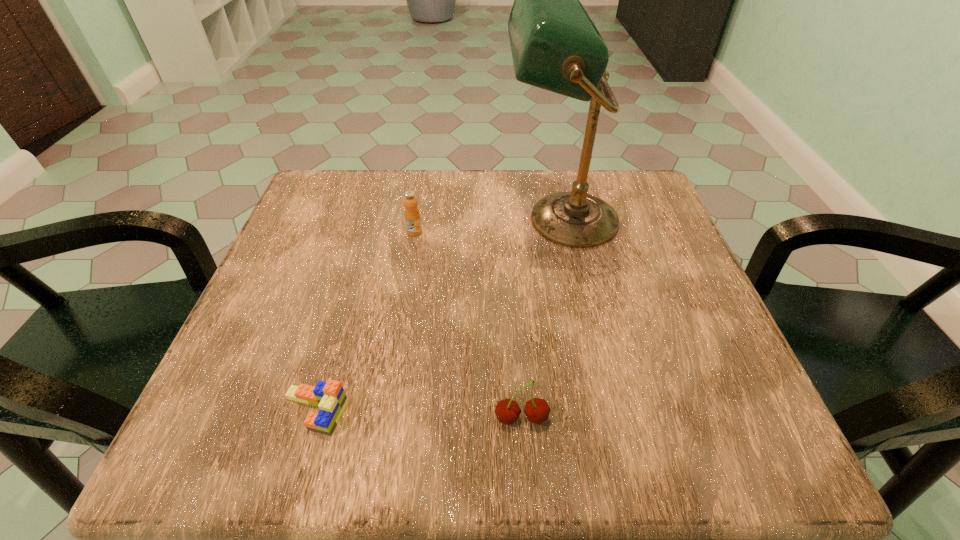
The image size is (960, 540). I want to click on the tallest object, so click(555, 46).

Image resolution: width=960 pixels, height=540 pixels. Identify the location of orange juice. (412, 215).

Find the location of a particular element. This screenshot has width=960, height=540. cherry is located at coordinates (537, 410).

The image size is (960, 540). Identify the location of the shortest object. (330, 397).

The height and width of the screenshot is (540, 960). Identify the location of Lego. (330, 397).

At what (x,y) coordinates should I click in order to perform the action: click on free space located 0.310m above the green lampshade of the table lamp. Please return your answer as a coordinate pair (x, y). This screenshot has width=960, height=540. Looking at the image, I should click on (364, 220).

What are the coordinates of `vacant space situated 0.120m above the green lampshade of the table lamp` in the screenshot? It's located at (449, 220).

In order to click on vacant space located above the green lampshade of the table lamp in this screenshot , I will do `click(396, 220)`.

Where is `vacant region located 0.320m on the front label of the orange juice`? vacant region located 0.320m on the front label of the orange juice is located at coordinates (393, 364).

Locate an element on the screen. The image size is (960, 540). vacant region located 0.140m on the back of the Lego is located at coordinates (341, 319).